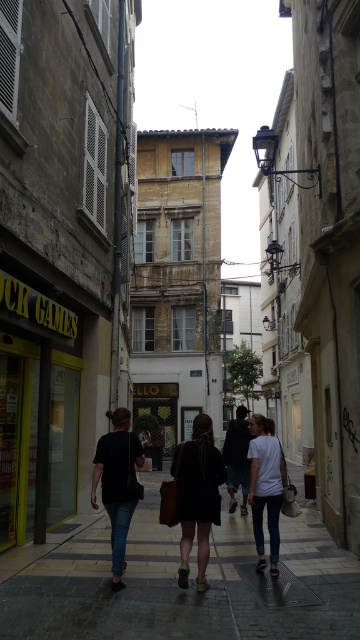
Who is shorter, dark gray stone pavement at center or dark brown leather jacket at center?

dark brown leather jacket at center is shorter.

Can you confirm if dark gray stone pavement at center is bigger than dark brown leather jacket at center?

Yes, dark gray stone pavement at center is bigger than dark brown leather jacket at center.

Is point (295, 531) closer to camera compared to point (209, 496)?

No.

This screenshot has width=360, height=640. Identify the location of dark gray stone pavement at center. (177, 586).

Which is below, dark brown leather jacket at center or white matte t-shirt at center?

Positioned lower is dark brown leather jacket at center.

This screenshot has height=640, width=360. What are the coordinates of `dark brown leather jacket at center` in the screenshot? It's located at (198, 496).

Identify the location of dark brown leather jacket at center. The height and width of the screenshot is (640, 360). (198, 496).

Can you confirm if black matte shirt at center is taller than white matte t-shirt at center?

Yes.

Between black matte shirt at center and white matte t-shirt at center, which one has less height?

With less height is white matte t-shirt at center.

Does point (110, 496) lie in front of point (254, 496)?

That is True.

You are a GUI agent. You are given a task and a screenshot of the screen. Output one action in this format:
    pyautogui.click(x=<x>, y=<y>)
    Task: Click on the black matte shirt at center
    
    Given the screenshot: What is the action you would take?
    pyautogui.click(x=118, y=483)